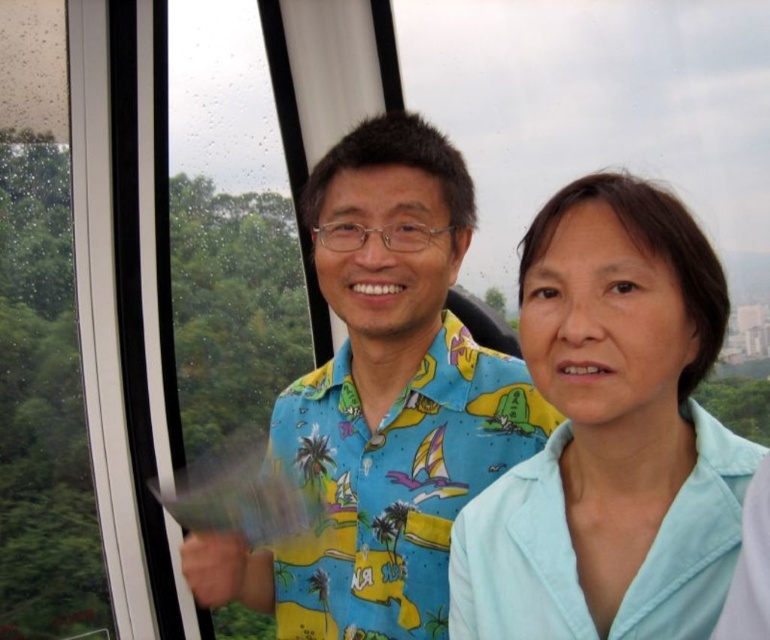
You are a photographer setting up a shoot in a room with a large window overlooking greenery. You notice two subjects wearing the light blue fabric at center and the printed fabric shirt at center. Which subject is positioned closer to the right side of the frame?

The light blue fabric at center is to the right of the printed fabric shirt at center, so the subject wearing the light blue fabric at center is positioned closer to the right side of the frame.